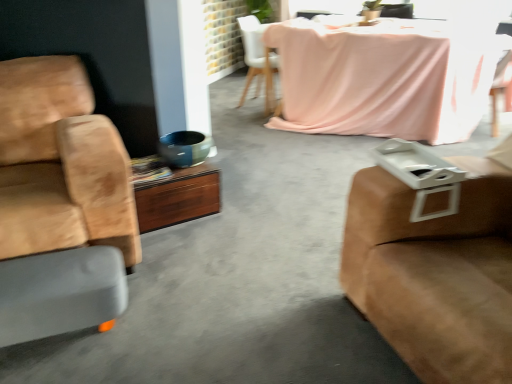
Where is `vacant region in front of wooden desk at center`? vacant region in front of wooden desk at center is located at coordinates (180, 252).